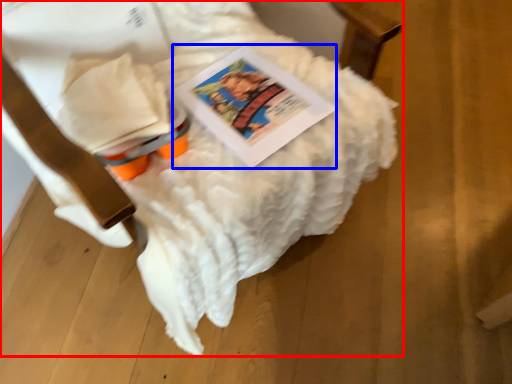
Question: Which of the following is the farthest to the observer, furniture (highlighted by a red box) or book (highlighted by a blue box)?

Choices:
 (A) furniture
 (B) book

Answer: (B)